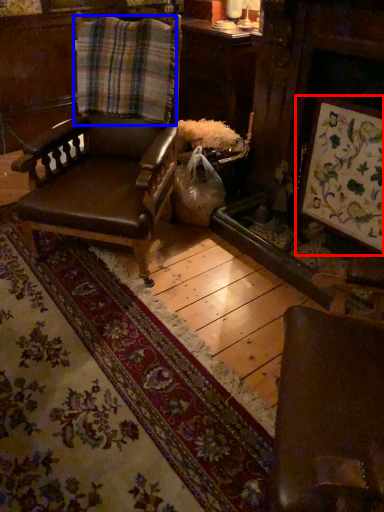
Question: Which of the following is the closest to the observer, picture frame (highlighted by a red box) or plaid (highlighted by a blue box)?

Choices:
 (A) picture frame
 (B) plaid

Answer: (A)